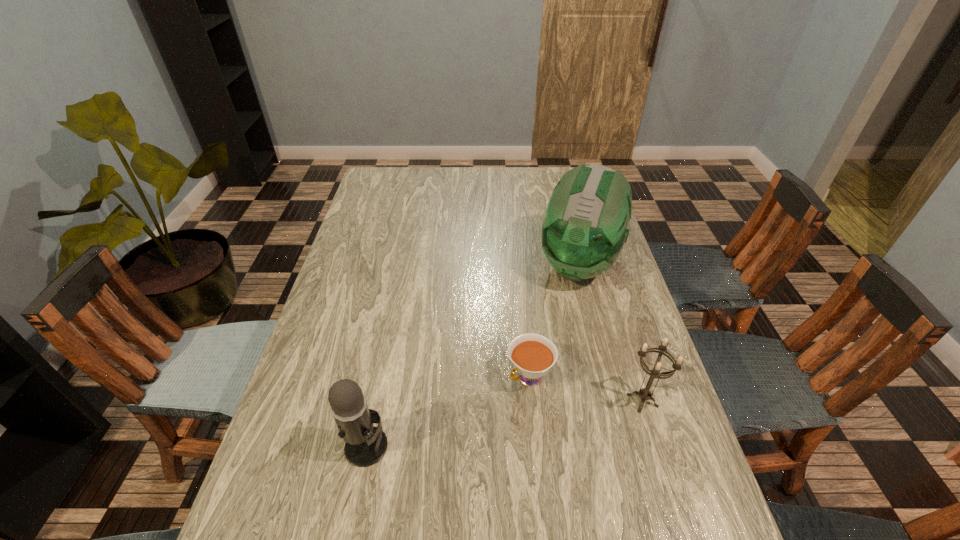
The height and width of the screenshot is (540, 960). In order to click on microphone in this screenshot , I will do coord(365,445).

Where is `the nearest object`? This screenshot has width=960, height=540. the nearest object is located at coordinates (365, 445).

This screenshot has height=540, width=960. I want to click on candle holder, so [x=644, y=393].

At what (x,y) coordinates should I click in order to perform the action: click on the tallest object. Please return your answer as a coordinate pair (x, y). Looking at the image, I should click on coord(584,228).

Find the location of `the farthest object`. the farthest object is located at coordinates (584, 228).

Image resolution: width=960 pixels, height=540 pixels. In order to click on the shortest object in this screenshot , I will do `click(532, 355)`.

Find the location of a particular element. vacant space located 0.150m on the back of the leftmost object is located at coordinates click(x=381, y=372).

Image resolution: width=960 pixels, height=540 pixels. Identify the location of free region located 0.180m on the front of the candle holder. (673, 497).

This screenshot has height=540, width=960. I want to click on free space located 0.230m on the visor of the football helmet, so click(x=546, y=353).

At what (x,y) coordinates should I click in order to perform the action: click on free space located on the visor of the football helmet. Please return your answer as a coordinate pair (x, y). The height and width of the screenshot is (540, 960). Looking at the image, I should click on (543, 359).